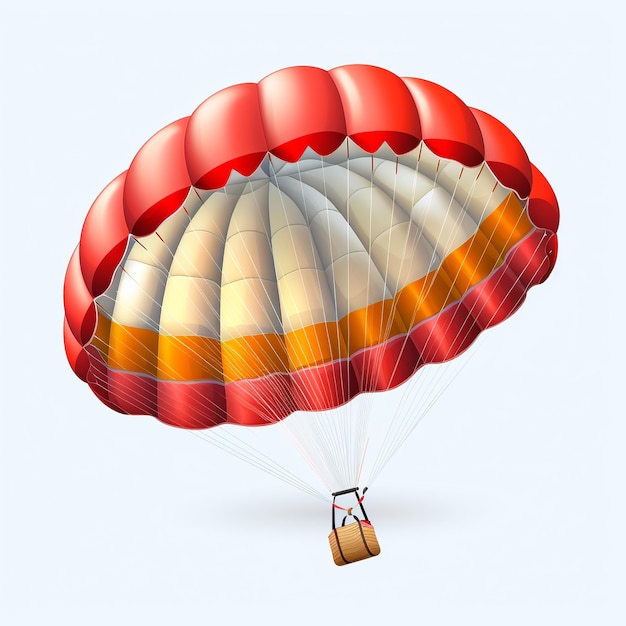
The image size is (626, 626). Find the location of `cable`. cable is located at coordinates (443, 394).